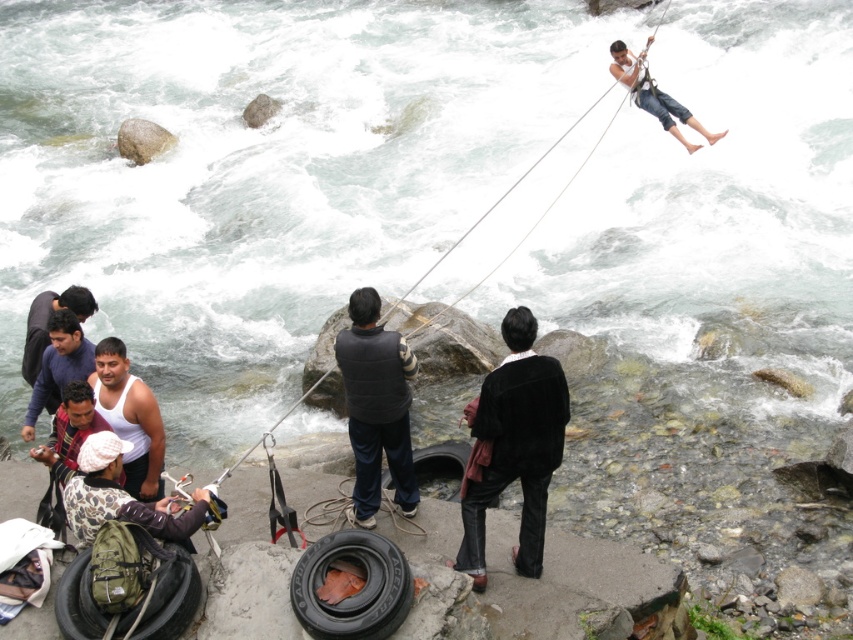
You are a photographer trying to capture the scene of the man swinging on the rope. You need to focus on the black suede jacket at center and light brown denim pants at upper right. Which of these two items is located more to the left in the image?

The black suede jacket at center is positioned on the left side of light brown denim pants at upper right, so the black suede jacket at center is more to the left.

You are standing at the point marked by the coordinates point [515,445]. What object is located exactly at this point?

The point [515,445] marks the location of the black suede jacket at center.

You are a photographer standing at the edge of the riverbank. You want to capture a photo of the light brown denim pants at upper right and the smooth gray rock at upper left. Which object should you frame first in your camera viewfinder to ensure both are in the shot?

You should frame the smooth gray rock at upper left first because the light brown denim pants at upper right is positioned on the right side of it, so starting with the rock ensures both objects are included in the frame.